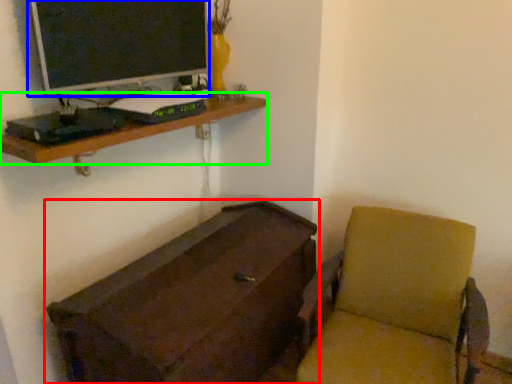
Question: Which object is positioned farthest from furniture (highlighted by a red box)? Select from computer monitor (highlighted by a blue box) and shelf (highlighted by a green box).

Choices:
 (A) computer monitor
 (B) shelf

Answer: (A)